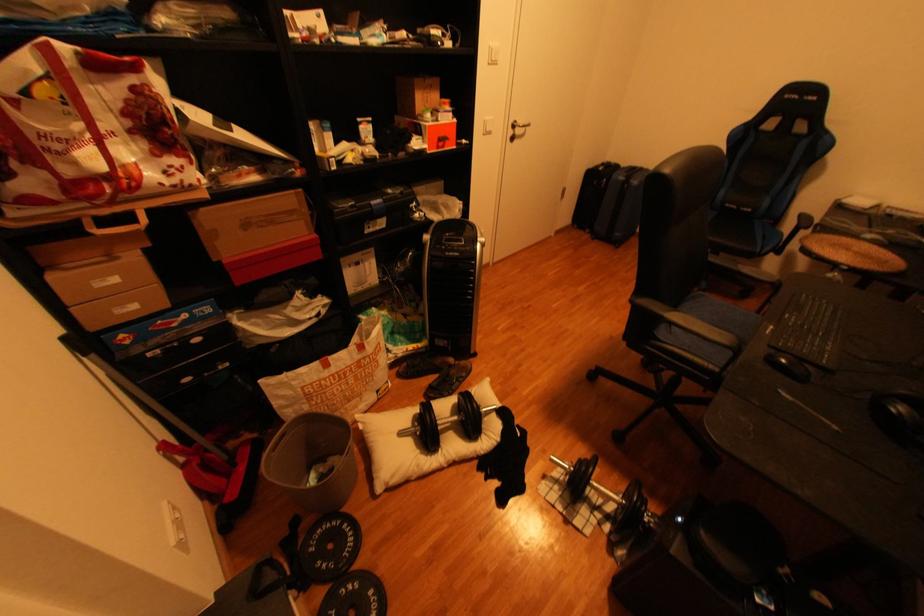
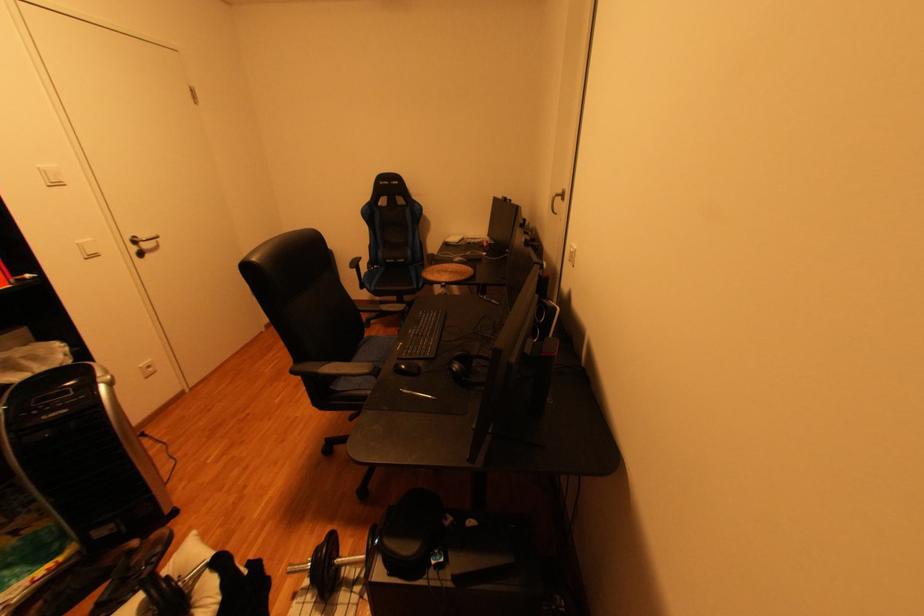
Question: The first image is from the beginning of the video and the second image is from the end. How did the camera likely rotate when shooting the video?

Choices:
 (A) Left
 (B) Right
 (C) Up
 (D) Down

Answer: (B)